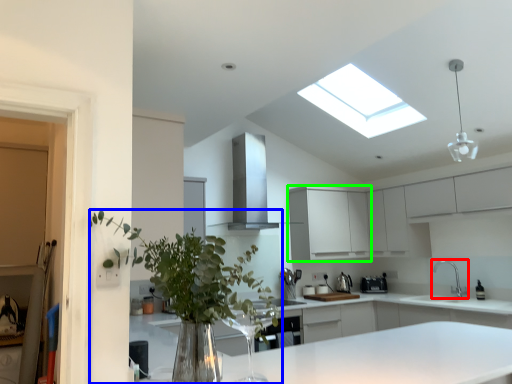
Question: Based on their relative distances, which object is farther from tap (highlighted by a red box)? Choose from houseplant (highlighted by a blue box) and cabinetry (highlighted by a green box).

Choices:
 (A) houseplant
 (B) cabinetry

Answer: (A)